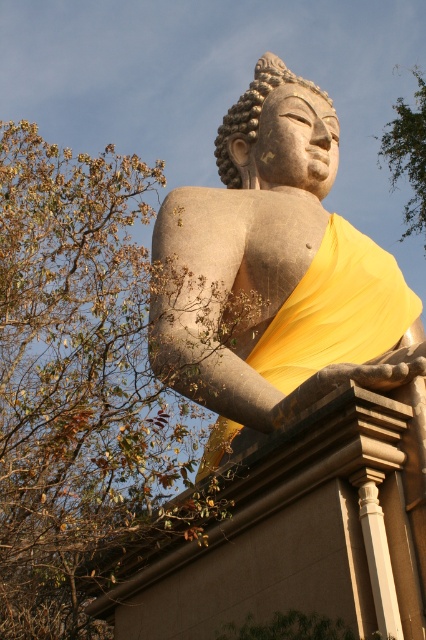
Question: Which object is positioned farthest from the matte stone buddha at center?

Choices:
 (A) brown leafy tree at upper left
 (B) green leafy tree at upper right

Answer: (B)

Question: Which of these objects is positioned farthest from the brown leafy tree at upper left?

Choices:
 (A) matte stone buddha at center
 (B) green leafy tree at upper right

Answer: (B)

Question: Does matte stone buddha at center have a larger size compared to green leafy tree at upper right?

Choices:
 (A) yes
 (B) no

Answer: (A)

Question: Can you confirm if matte stone buddha at center is bigger than green leafy tree at upper right?

Choices:
 (A) yes
 (B) no

Answer: (A)

Question: Estimate the real-world distances between objects in this image. Which object is farther from the green leafy tree at upper right?

Choices:
 (A) brown leafy tree at upper left
 (B) matte stone buddha at center

Answer: (B)

Question: Does brown leafy tree at upper left have a lesser width compared to green leafy tree at upper right?

Choices:
 (A) no
 (B) yes

Answer: (A)